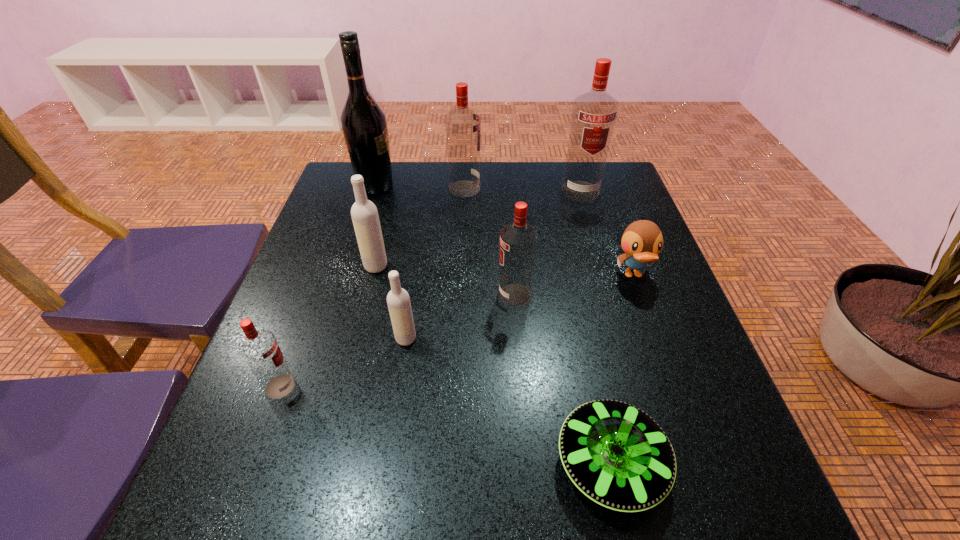
In the image, there is a desktop. Identify the location of vacant space at the right edge. The height and width of the screenshot is (540, 960). (589, 220).

At what (x,y) coordinates should I click in order to perform the action: click on free space at the far right corner of the desktop. Please return your answer as a coordinate pair (x, y). The height and width of the screenshot is (540, 960). Looking at the image, I should click on (615, 192).

At what (x,y) coordinates should I click in order to perform the action: click on empty space that is in between the second smallest red vodka and the nearest object. Please return your answer as a coordinate pair (x, y). The width and height of the screenshot is (960, 540). Looking at the image, I should click on (563, 379).

Where is `vacant point located between the fifth vodka from right to left and the sixth object from left to right`? Image resolution: width=960 pixels, height=540 pixels. vacant point located between the fifth vodka from right to left and the sixth object from left to right is located at coordinates (445, 280).

Locate an element on the screen. This screenshot has height=540, width=960. vacant region between the fourth vodka from left to right and the third red vodka from left to right is located at coordinates (490, 242).

Find the location of `free space between the wine bottle and the shortest object`. free space between the wine bottle and the shortest object is located at coordinates (493, 325).

Locate an element on the screen. vacant space in between the nearest object and the second biggest red vodka is located at coordinates (538, 326).

In order to click on vacant space in between the blue duck and the fifth shortest vodka in this screenshot , I will do `click(549, 232)`.

Identify the location of vacant area between the fourth farthest vodka and the duck. This screenshot has height=540, width=960. (574, 285).

At what (x,y) coordinates should I click in order to perform the action: click on vacant region between the third farthest red vodka and the blue duck. Please return your answer as a coordinate pair (x, y). The width and height of the screenshot is (960, 540). Looking at the image, I should click on (574, 285).